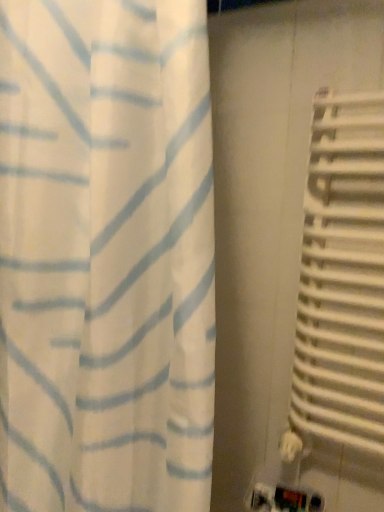
Question: Does white metallic radiator at right come behind white fabric curtain at left?

Choices:
 (A) yes
 (B) no

Answer: (A)

Question: From a real-world perspective, is white metallic radiator at right physically below white fabric curtain at left?

Choices:
 (A) no
 (B) yes

Answer: (B)

Question: Can you confirm if white metallic radiator at right is shorter than white fabric curtain at left?

Choices:
 (A) no
 (B) yes

Answer: (B)

Question: Can you confirm if white metallic radiator at right is taller than white fabric curtain at left?

Choices:
 (A) no
 (B) yes

Answer: (A)

Question: Considering the relative sizes of white metallic radiator at right and white fabric curtain at left in the image provided, is white metallic radiator at right thinner than white fabric curtain at left?

Choices:
 (A) no
 (B) yes

Answer: (B)

Question: Considering the relative positions of white metallic radiator at right and white fabric curtain at left in the image provided, is white metallic radiator at right to the left of white fabric curtain at left from the viewer's perspective?

Choices:
 (A) no
 (B) yes

Answer: (A)

Question: Does white fabric curtain at left have a smaller size compared to white metallic radiator at right?

Choices:
 (A) yes
 (B) no

Answer: (B)

Question: Considering the relative sizes of white fabric curtain at left and white metallic radiator at right in the image provided, is white fabric curtain at left thinner than white metallic radiator at right?

Choices:
 (A) no
 (B) yes

Answer: (A)

Question: Is white fabric curtain at left wider than white metallic radiator at right?

Choices:
 (A) no
 (B) yes

Answer: (B)

Question: Considering the relative positions of white fabric curtain at left and white metallic radiator at right in the image provided, is white fabric curtain at left to the right of white metallic radiator at right from the viewer's perspective?

Choices:
 (A) no
 (B) yes

Answer: (A)

Question: From a real-world perspective, does white fabric curtain at left sit lower than white metallic radiator at right?

Choices:
 (A) no
 (B) yes

Answer: (A)

Question: Does white fabric curtain at left appear on the left side of white metallic radiator at right?

Choices:
 (A) yes
 (B) no

Answer: (A)

Question: Considering the positions of point (200, 219) and point (370, 120), is point (200, 219) closer or farther from the camera than point (370, 120)?

Choices:
 (A) closer
 (B) farther

Answer: (A)